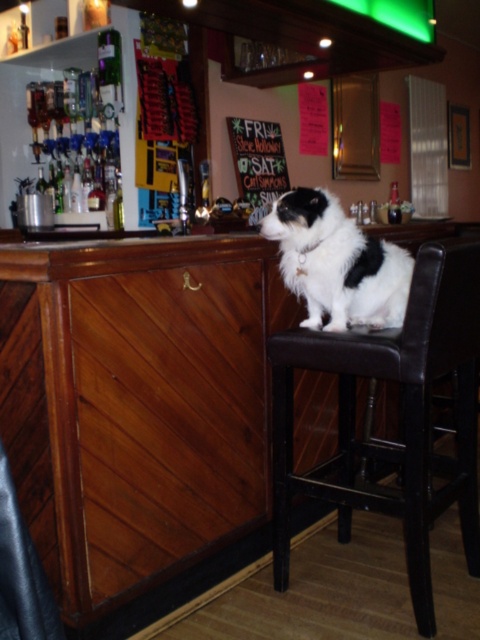
You are a bartender who needs to place a new menu board that is 1.2 meters tall. The black and white fur at center and the wooden signboard at center are already on the counter. Can you determine which object is shorter and thus where the new menu board might fit better?

The black and white fur at center is shorter than the wooden signboard at center. Since the new menu board is 1.2 meters tall, it might fit better next to the black and white fur at center if you want a shorter companion, or near the wooden signboard at center if you prefer a taller arrangement.

You are a bartender who just finished cleaning a 12 inch long tray. You need to place it between the brown leather chair at center and the black and white fur at center. Can the tray fit in the space between them?

The distance between the brown leather chair at center and the black and white fur at center is 12.65 inches. Since the tray is 12 inches long, it can fit in the space between them as the available space is slightly larger than the tray.